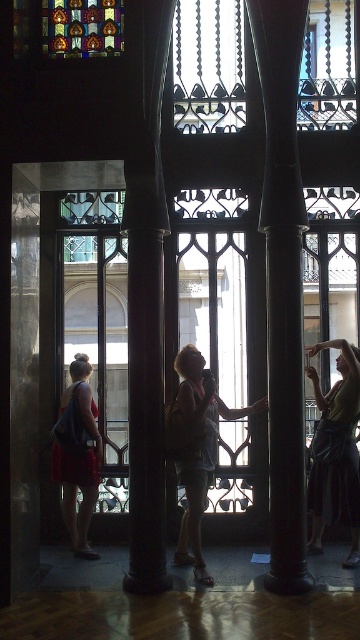
Question: Which point is farther to the camera?

Choices:
 (A) stained glass window at upper left
 (B) green fabric dress at right
 (C) dark brown polished wood pillar at center
 (D) matte gray tank top at center

Answer: (B)

Question: Can you confirm if black polished column at center is thinner than green fabric dress at right?

Choices:
 (A) no
 (B) yes

Answer: (A)

Question: Which object is the farthest from the black polished column at center?

Choices:
 (A) dark brown polished wood pillar at center
 (B) matte gray tank top at center

Answer: (A)

Question: Is black polished column at center smaller than stained glass window at upper left?

Choices:
 (A) yes
 (B) no

Answer: (B)

Question: Which point is farther from the camera taking this photo?

Choices:
 (A) (61, 401)
 (B) (203, 484)

Answer: (A)

Question: Is green fabric dress at right below stained glass window at upper left?

Choices:
 (A) no
 (B) yes

Answer: (B)